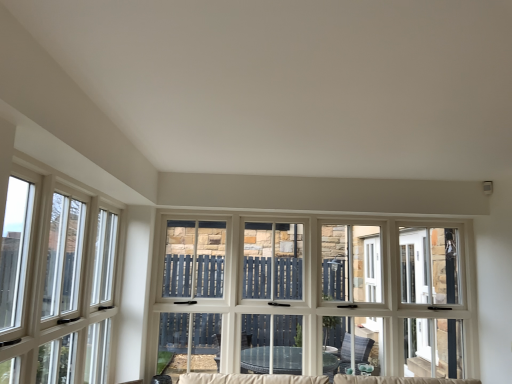
Describe the element at coordinates (313, 295) in the screenshot. I see `white wood window at center, which is counted as the second window, starting from the left` at that location.

Identify the location of white wood window at center, which is counted as the second window, starting from the left. (313, 295).

What is the approximate width of white wood window at center, which is counted as the second window, starting from the left?

8.98 inches.

Where is `clear glass window at left, placed as the first window when sorted from front to back`? The width and height of the screenshot is (512, 384). clear glass window at left, placed as the first window when sorted from front to back is located at coordinates (58, 284).

Describe the element at coordinates (58, 284) in the screenshot. The image size is (512, 384). I see `clear glass window at left, which appears as the 2th window when viewed from the right` at that location.

Locate an element on the screen. The height and width of the screenshot is (384, 512). white wood window at center, the second window when ordered from front to back is located at coordinates (313, 295).

Does white wood window at center, the second window when ordered from front to back, appear on the right side of clear glass window at left, placed as the first window when sorted from front to back?

Correct, you'll find white wood window at center, the second window when ordered from front to back, to the right of clear glass window at left, placed as the first window when sorted from front to back.

Considering their positions, is white wood window at center, arranged as the first window when viewed from the back, located in front of or behind clear glass window at left, placed as the first window when sorted from front to back?

white wood window at center, arranged as the first window when viewed from the back, is behind clear glass window at left, placed as the first window when sorted from front to back.

Is point (244, 353) closer to viewer compared to point (18, 357)?

No, it is behind (18, 357).

From the image's perspective, between white wood window at center, which is the 1th window from right to left, and clear glass window at left, which appears as the 2th window when viewed from the right, who is located below?

white wood window at center, which is the 1th window from right to left, is shown below in the image.

From a real-world perspective, is white wood window at center, which is counted as the second window, starting from the left, located beneath clear glass window at left, which appears as the 2th window when viewed from the right?

Correct, in the physical world, white wood window at center, which is counted as the second window, starting from the left, is lower than clear glass window at left, which appears as the 2th window when viewed from the right.

Can you confirm if white wood window at center, arranged as the first window when viewed from the back, is thinner than clear glass window at left, which is counted as the first window, starting from the left?

Incorrect, the width of white wood window at center, arranged as the first window when viewed from the back, is not less than that of clear glass window at left, which is counted as the first window, starting from the left.

From the picture: Can you confirm if white wood window at center, which is counted as the second window, starting from the left, is taller than clear glass window at left, which is the second window in back-to-front order?

Yes, white wood window at center, which is counted as the second window, starting from the left, is taller than clear glass window at left, which is the second window in back-to-front order.

Considering the sizes of white wood window at center, the second window when ordered from front to back, and clear glass window at left, which appears as the 2th window when viewed from the right, in the image, is white wood window at center, the second window when ordered from front to back, bigger or smaller than clear glass window at left, which appears as the 2th window when viewed from the right,?

In the image, white wood window at center, the second window when ordered from front to back, appears to be larger than clear glass window at left, which appears as the 2th window when viewed from the right.

Is white wood window at center, which is counted as the second window, starting from the left, situated inside clear glass window at left, which is counted as the first window, starting from the left, or outside?

white wood window at center, which is counted as the second window, starting from the left, is outside clear glass window at left, which is counted as the first window, starting from the left.

Is white wood window at center, which is the 1th window from right to left, next to clear glass window at left, which is counted as the first window, starting from the left?

No, white wood window at center, which is the 1th window from right to left, is not touching clear glass window at left, which is counted as the first window, starting from the left.

Could you tell me if white wood window at center, the second window when ordered from front to back, is turned towards clear glass window at left, which is counted as the first window, starting from the left?

Yes, white wood window at center, the second window when ordered from front to back, is oriented towards clear glass window at left, which is counted as the first window, starting from the left.

What's the angular difference between white wood window at center, which is the 1th window from right to left, and clear glass window at left, which appears as the 2th window when viewed from the right,'s facing directions?

The angular difference between white wood window at center, which is the 1th window from right to left, and clear glass window at left, which appears as the 2th window when viewed from the right, is 90.3 degrees.

At what (x,y) coordinates should I click in order to perform the action: click on window below the clear glass window at left, which is counted as the first window, starting from the left (from the image's perspective). Please return your answer as a coordinate pair (x, y). The image size is (512, 384). Looking at the image, I should click on (313, 295).

Between clear glass window at left, which is counted as the first window, starting from the left, and white wood window at center, which is the 1th window from right to left, which one appears on the left side from the viewer's perspective?

From the viewer's perspective, clear glass window at left, which is counted as the first window, starting from the left, appears more on the left side.

Which object is further away from the camera, clear glass window at left, placed as the first window when sorted from front to back, or white wood window at center, which is the 1th window from right to left?

white wood window at center, which is the 1th window from right to left, is behind.

Is point (69, 300) closer or farther from the camera than point (320, 220)?

Point (69, 300).

Based on the photo, from the image's perspective, is clear glass window at left, placed as the first window when sorted from front to back, located beneath white wood window at center, which is the 1th window from right to left?

No.

From a real-world perspective, is clear glass window at left, which appears as the 2th window when viewed from the right, above or below white wood window at center, arranged as the first window when viewed from the back?

From a real-world perspective, clear glass window at left, which appears as the 2th window when viewed from the right, is physically above white wood window at center, arranged as the first window when viewed from the back.

Which of these two, clear glass window at left, which is the second window in back-to-front order, or white wood window at center, arranged as the first window when viewed from the back, is thinner?

clear glass window at left, which is the second window in back-to-front order, is thinner.

Does clear glass window at left, which is counted as the first window, starting from the left, have a greater height compared to white wood window at center, the second window when ordered from front to back?

No, clear glass window at left, which is counted as the first window, starting from the left, is not taller than white wood window at center, the second window when ordered from front to back.

Does clear glass window at left, placed as the first window when sorted from front to back, have a larger size compared to white wood window at center, the second window when ordered from front to back?

No, clear glass window at left, placed as the first window when sorted from front to back, is not bigger than white wood window at center, the second window when ordered from front to back.

Is clear glass window at left, placed as the first window when sorted from front to back, not inside white wood window at center, the second window when ordered from front to back?

That's correct, clear glass window at left, placed as the first window when sorted from front to back, is outside of white wood window at center, the second window when ordered from front to back.

Are clear glass window at left, which is the second window in back-to-front order, and white wood window at center, the second window when ordered from front to back, beside each other?

No, clear glass window at left, which is the second window in back-to-front order, is not in contact with white wood window at center, the second window when ordered from front to back.

Is white wood window at center, the second window when ordered from front to back, at the back of clear glass window at left, which is counted as the first window, starting from the left?

No, clear glass window at left, which is counted as the first window, starting from the left,'s orientation is not away from white wood window at center, the second window when ordered from front to back.

How different are the orientations of clear glass window at left, which is counted as the first window, starting from the left, and white wood window at center, which is counted as the second window, starting from the left, in degrees?

The angle between the facing direction of clear glass window at left, which is counted as the first window, starting from the left, and the facing direction of white wood window at center, which is counted as the second window, starting from the left, is 90.3 degrees.

Could you measure the distance between clear glass window at left, which is counted as the first window, starting from the left, and white wood window at center, the second window when ordered from front to back?

A distance of 1.23 meters exists between clear glass window at left, which is counted as the first window, starting from the left, and white wood window at center, the second window when ordered from front to back.

Where is `window on the left of white wood window at center, arranged as the first window when viewed from the back`? This screenshot has height=384, width=512. window on the left of white wood window at center, arranged as the first window when viewed from the back is located at coordinates (58, 284).

You are a GUI agent. You are given a task and a screenshot of the screen. Output one action in this format:
    pyautogui.click(x=<x>, y=<y>)
    Task: Click on the window located in front of the white wood window at center, arranged as the first window when viewed from the back
    The width and height of the screenshot is (512, 384).
    Given the screenshot: What is the action you would take?
    pyautogui.click(x=58, y=284)

This screenshot has height=384, width=512. I want to click on window lying behind the clear glass window at left, placed as the first window when sorted from front to back, so click(x=313, y=295).